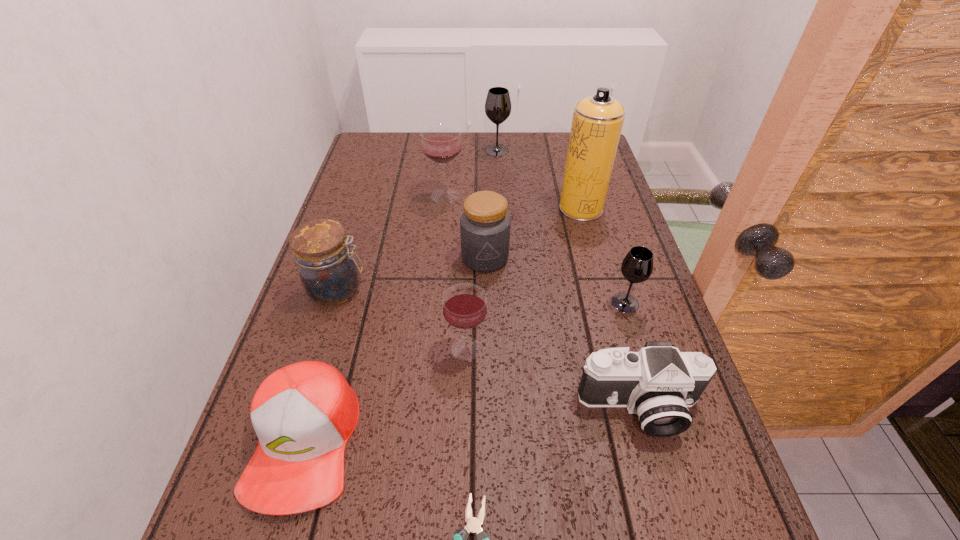
What are the coordinates of `free point between the camera and the smaller red wineglass` in the screenshot? It's located at (552, 378).

Locate an element on the screen. This screenshot has width=960, height=540. blank region between the smaller red wineglass and the red baseball cap is located at coordinates (385, 395).

Find the location of a particular element. The height and width of the screenshot is (540, 960). free spot between the baseball cap and the black camera is located at coordinates tap(471, 424).

The height and width of the screenshot is (540, 960). In order to click on free space that is in between the black camera and the farther red wineglass in this screenshot , I will do `click(541, 302)`.

I want to click on vacant area between the nearer red wineglass and the camera, so click(552, 378).

The width and height of the screenshot is (960, 540). What are the coordinates of `the ninth closest object to the gray jar` in the screenshot? It's located at (473, 526).

Where is `object that is the seventh closest to the smaller gray wineglass`? object that is the seventh closest to the smaller gray wineglass is located at coordinates (304, 414).

Select which wineglass appears as the third closest to the left jar. Please provide its 2D coordinates. Your answer should be formatted as a tuple, i.e. [(x, y)], where the tuple contains the x and y coordinates of a point satisfying the conditions above.

[(637, 266)]

Point out which wineglass is positioned as the fourth nearest to the gray jar. Please provide its 2D coordinates. Your answer should be formatted as a tuple, i.e. [(x, y)], where the tuple contains the x and y coordinates of a point satisfying the conditions above.

[(498, 104)]

Locate an element on the screen. This screenshot has height=540, width=960. free spot that satisfies the following two spatial constraints: 1. on the lid of the left jar; 2. on the back side of the smaller gray wineglass is located at coordinates (333, 303).